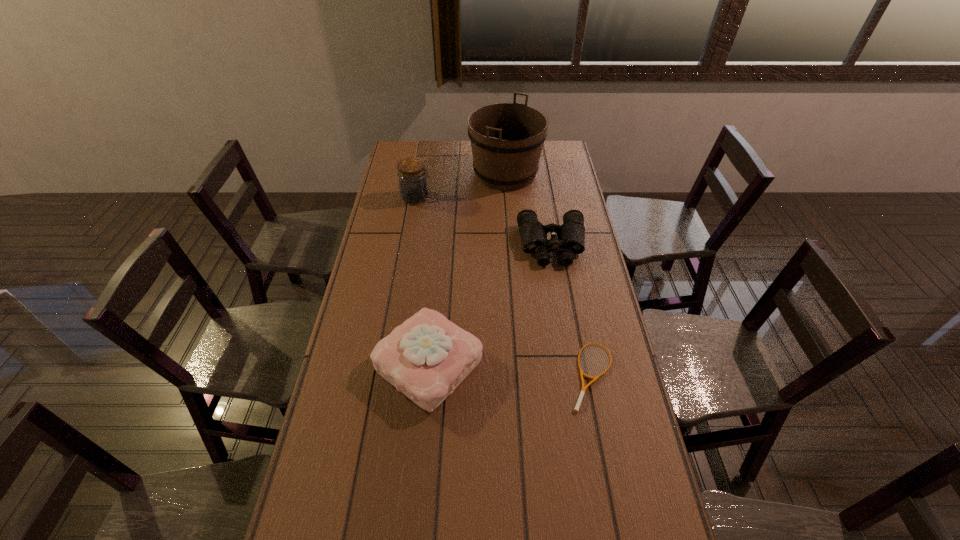
This screenshot has height=540, width=960. What are the coordinates of `free location that satisfies the following two spatial constraints: 1. on the lid of the jar; 2. on the right side of the tennis racket` in the screenshot? It's located at (386, 375).

Identify the location of free space that satisfies the following two spatial constraints: 1. through the eyepieces of the fourth tallest object; 2. on the left side of the tennis racket. (574, 375).